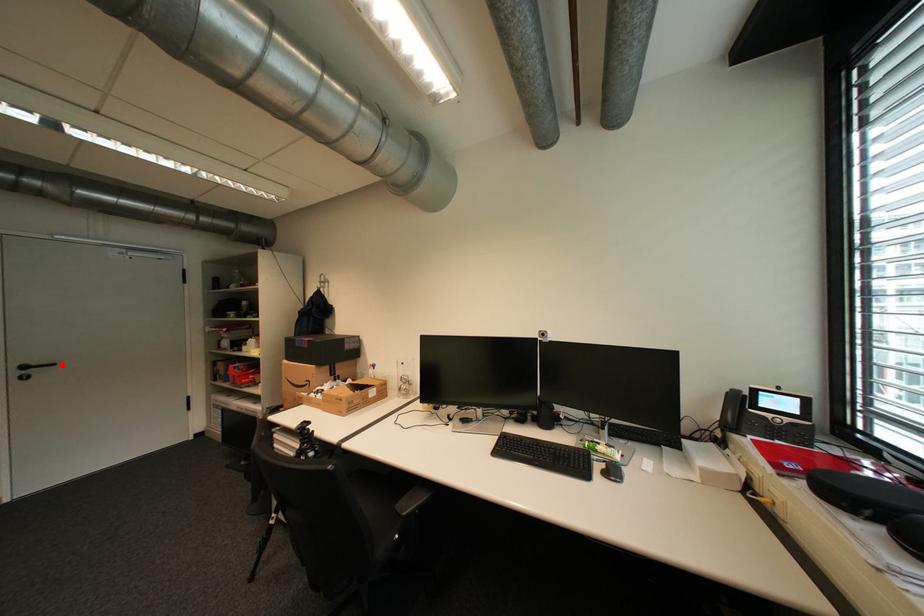
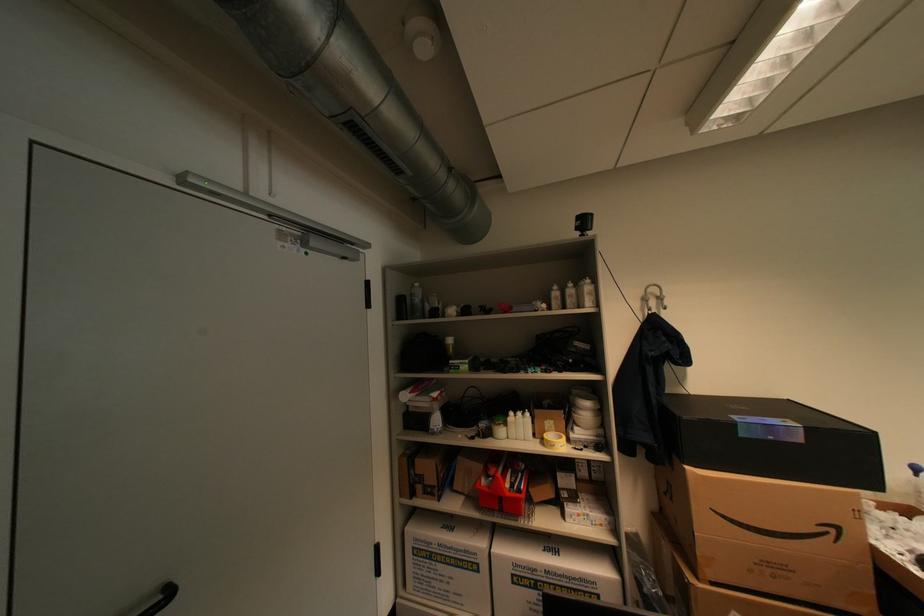
Locate, in the second image, the point that corresponds to the highlighted location in the first image.

(176, 594)